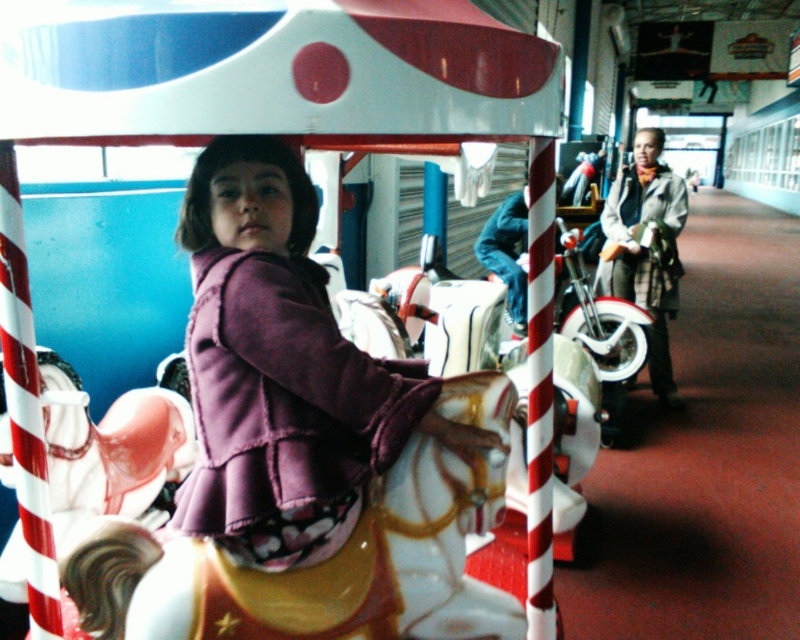
Question: Which point is farther from the camera taking this photo?

Choices:
 (A) (182, 493)
 (B) (474, 291)

Answer: (B)

Question: Which point is farther to the camera?

Choices:
 (A) (396, 378)
 (B) (482, 612)

Answer: (B)

Question: Considering the relative positions of purple fleece jacket at center and shiny chrome motorcycle at center in the image provided, where is purple fleece jacket at center located with respect to shiny chrome motorcycle at center?

Choices:
 (A) above
 (B) below

Answer: (A)

Question: Can you confirm if shiny metallic motorcycle at center is wider than shiny chrome motorcycle at center?

Choices:
 (A) no
 (B) yes

Answer: (A)

Question: Which point is farther from the camera taking this photo?

Choices:
 (A) (222, 406)
 (B) (458, 630)
 (C) (578, 346)

Answer: (C)

Question: Is shiny metallic motorcycle at center thinner than shiny chrome motorcycle at center?

Choices:
 (A) no
 (B) yes

Answer: (B)